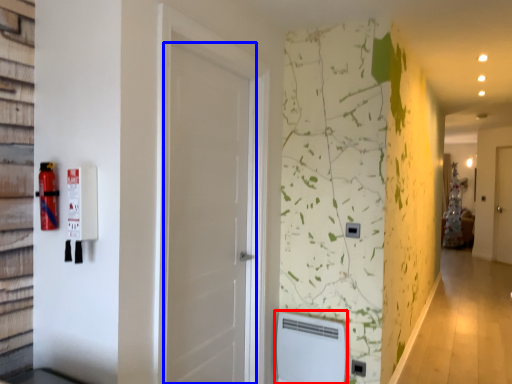
Question: Which of the following is the farthest to the observer, water heater (highlighted by a red box) or door (highlighted by a blue box)?

Choices:
 (A) water heater
 (B) door

Answer: (A)